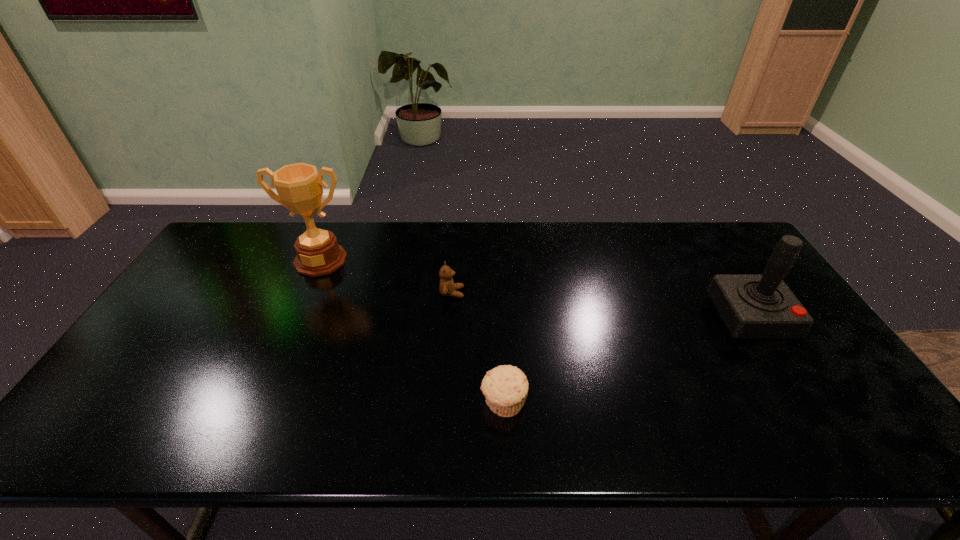
What are the coordinates of `vacant space situated on the right of the third object from left to right` in the screenshot? It's located at click(x=560, y=403).

Identify the location of object at the far edge. This screenshot has width=960, height=540. (299, 186).

This screenshot has width=960, height=540. Find the location of `object present at the near edge`. object present at the near edge is located at coordinates (505, 387).

The image size is (960, 540). Identify the location of object at the right edge. (752, 306).

This screenshot has width=960, height=540. In the image, there is a desktop. In order to click on vacant space at the far edge in this screenshot , I will do `click(392, 224)`.

Find the location of a particular element. free region at the near edge is located at coordinates (562, 436).

In the image, there is a desktop. Find the location of `vacant space at the left edge`. vacant space at the left edge is located at coordinates (230, 282).

Image resolution: width=960 pixels, height=540 pixels. In the image, there is a desktop. Find the location of `vacant area at the right edge`. vacant area at the right edge is located at coordinates (828, 402).

Locate an element on the screen. This screenshot has height=540, width=960. free space at the far left corner is located at coordinates (221, 254).

You are a GUI agent. You are given a task and a screenshot of the screen. Output one action in this format:
    pyautogui.click(x=<x>, y=<y>)
    Task: Click on the blank area at the near left corner
    
    Given the screenshot: What is the action you would take?
    pyautogui.click(x=84, y=448)